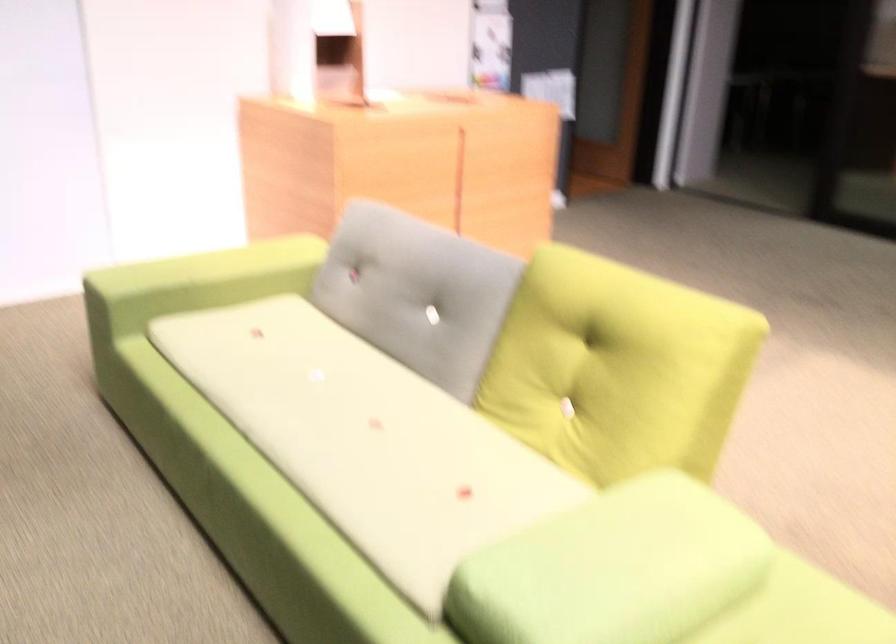
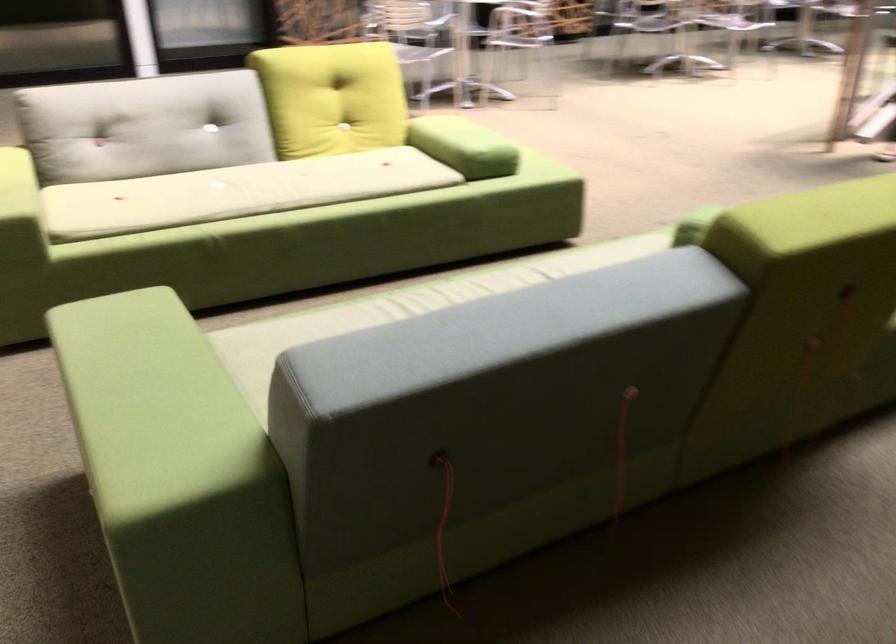
In the second image, find the point that corresponds to (x=272, y=384) in the first image.

(236, 192)